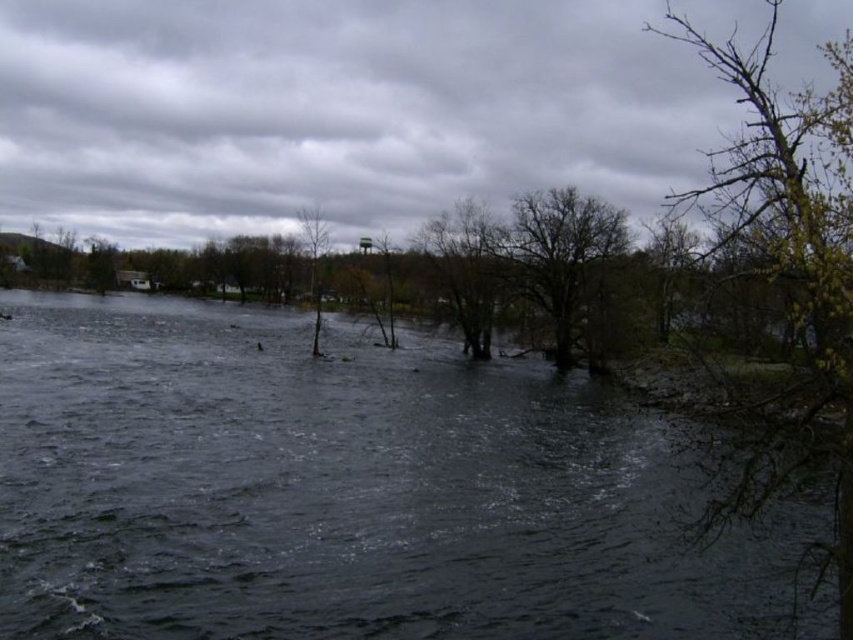
Question: Which object is positioned farthest from the dark water at center?

Choices:
 (A) bare branches at upper right
 (B) brown rough tree at center
 (C) bare branches tree at center

Answer: (A)

Question: From the image, what is the correct spatial relationship of dark water at center in relation to bare branches at upper right?

Choices:
 (A) right
 (B) left

Answer: (B)

Question: Is dark water at center to the left of bare branches tree at center from the viewer's perspective?

Choices:
 (A) no
 (B) yes

Answer: (B)

Question: Based on their relative distances, which object is farther from the bare wood tree at center?

Choices:
 (A) dark water at center
 (B) bare branches at upper right

Answer: (B)

Question: Which object is positioned closest to the bare wood tree at center?

Choices:
 (A) bare branches tree at center
 (B) dark water at center
 (C) bare branches at upper right
 (D) brown rough tree at center

Answer: (D)

Question: Is bare branches at upper right wider than bare wood tree at center?

Choices:
 (A) no
 (B) yes

Answer: (B)